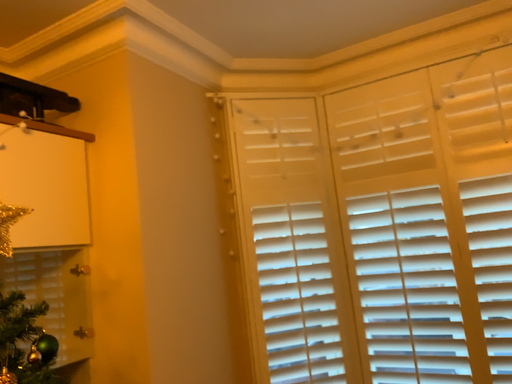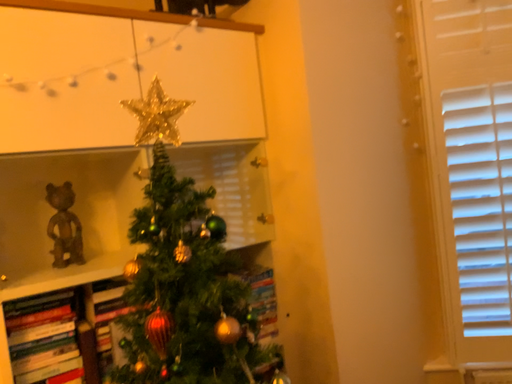
Question: How did the camera likely rotate when shooting the video?

Choices:
 (A) rotated right
 (B) rotated left

Answer: (B)